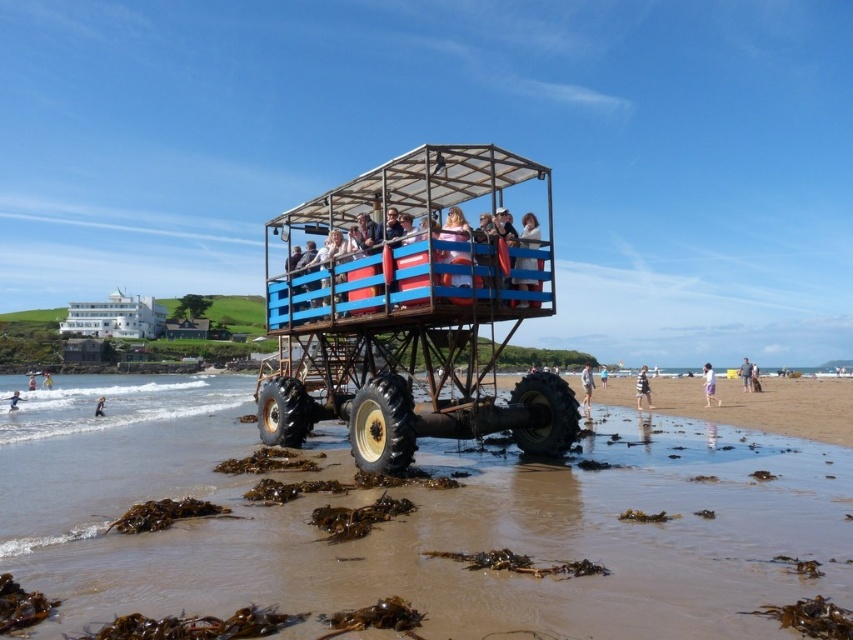
Which is above, white wetsuit at lower center or light brown wooden surfboard at center?

white wetsuit at lower center

Find the location of a particular element. white wetsuit at lower center is located at coordinates (99, 406).

Is light blue fabric shirt at center thinner than blue fabric shirt at center?

No.

Is point (746, 385) behind point (607, 376)?

No, it is in front of (607, 376).

Image resolution: width=853 pixels, height=640 pixels. What do you see at coordinates (746, 374) in the screenshot? I see `light blue fabric shirt at center` at bounding box center [746, 374].

Where is `light blue fabric shirt at center`? Image resolution: width=853 pixels, height=640 pixels. light blue fabric shirt at center is located at coordinates (746, 374).

Between point (379, 196) and point (749, 376), which one is positioned in front?

Positioned in front is point (379, 196).

Is metallic blue monster truck at center taller than light blue fabric shirt at center?

Incorrect, metallic blue monster truck at center's height is not larger of light blue fabric shirt at center's.

At what (x,y) coordinates should I click in order to perform the action: click on metallic blue monster truck at center. Please return your answer as a coordinate pair (x, y). Looking at the image, I should click on (413, 310).

What are the coordinates of `metallic blue monster truck at center` in the screenshot? It's located at (413, 310).